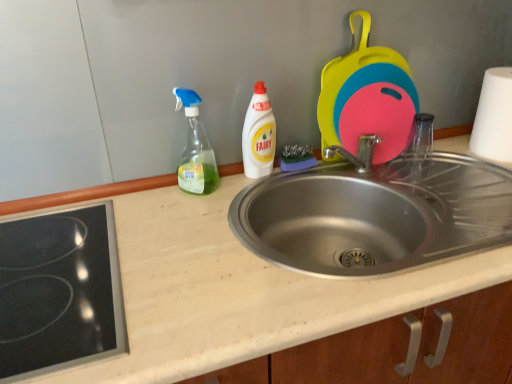
Question: Is silicone cutting boards at upper right at the right side of beige laminate counter top at center?

Choices:
 (A) yes
 (B) no

Answer: (A)

Question: Is silicone cutting boards at upper right thinner than beige laminate counter top at center?

Choices:
 (A) yes
 (B) no

Answer: (A)

Question: Does silicone cutting boards at upper right have a greater height compared to beige laminate counter top at center?

Choices:
 (A) no
 (B) yes

Answer: (A)

Question: From a real-world perspective, is silicone cutting boards at upper right under beige laminate counter top at center?

Choices:
 (A) no
 (B) yes

Answer: (A)

Question: Considering the relative sizes of silicone cutting boards at upper right and beige laminate counter top at center in the image provided, is silicone cutting boards at upper right wider than beige laminate counter top at center?

Choices:
 (A) yes
 (B) no

Answer: (B)

Question: Considering their positions, is beige laminate counter top at center located in front of or behind transparent plastic spray bottle at center, the 1th bottle in the left-to-right sequence?

Choices:
 (A) front
 (B) behind

Answer: (A)

Question: Considering the positions of beige laminate counter top at center and transparent plastic spray bottle at center, the 1th bottle in the left-to-right sequence, in the image, is beige laminate counter top at center taller or shorter than transparent plastic spray bottle at center, the 1th bottle in the left-to-right sequence,?

Choices:
 (A) tall
 (B) short

Answer: (A)

Question: Looking at the image, does beige laminate counter top at center seem bigger or smaller compared to transparent plastic spray bottle at center, the 1th bottle in the left-to-right sequence?

Choices:
 (A) small
 (B) big

Answer: (B)

Question: Is point (330, 322) positioned closer to the camera than point (195, 132)?

Choices:
 (A) farther
 (B) closer

Answer: (B)

Question: Considering the positions of point (501, 158) and point (275, 248), is point (501, 158) closer or farther from the camera than point (275, 248)?

Choices:
 (A) farther
 (B) closer

Answer: (A)

Question: Looking at their shapes, would you say white matte paper towel at right is wider or thinner than stainless steel sink at center?

Choices:
 (A) thin
 (B) wide

Answer: (A)

Question: Is white matte paper towel at right inside or outside of stainless steel sink at center?

Choices:
 (A) inside
 (B) outside

Answer: (B)

Question: From a real-world perspective, is white matte paper towel at right positioned above or below stainless steel sink at center?

Choices:
 (A) below
 (B) above

Answer: (B)

Question: Looking at the image, does silicone cutting boards at upper right seem bigger or smaller compared to white matte paper towel at right?

Choices:
 (A) big
 (B) small

Answer: (A)

Question: Looking at their shapes, would you say silicone cutting boards at upper right is wider or thinner than white matte paper towel at right?

Choices:
 (A) thin
 (B) wide

Answer: (A)